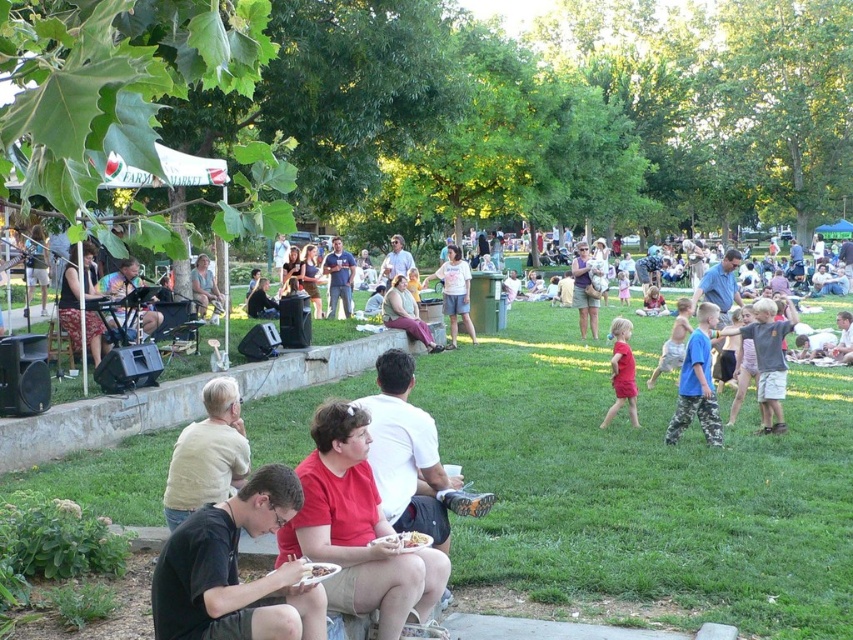
You are organizing a photo shoot and need to position two models wearing the red cotton shirt at center and the matte black shirt at left. Since you want to emphasize the larger of the two shirts, which model should you place in a more prominent position?

The matte black shirt at left should be placed in a more prominent position because it occupies more space than the red cotton shirt at center.

You are a photographer at the park and want to capture both the red cotton shirt at center and the matte black shirt at left in a single photo. Which shirt should you position closer to the center of the frame to ensure both are visible?

The red cotton shirt at center should be positioned closer to the center of the frame since it is already located to the right of the matte black shirt at left, allowing both to be captured in the photo without cropping either out.